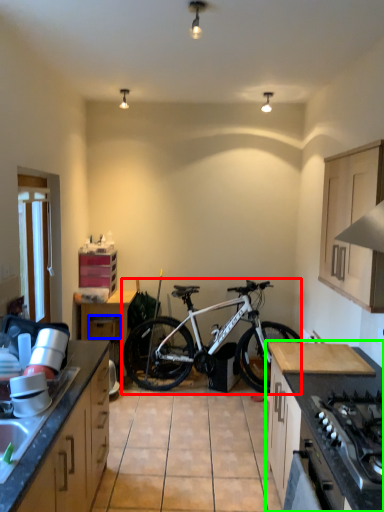
Question: Which object is positioned farthest from bicycle (highlighted by a red box)? Select from drawer (highlighted by a blue box) and cabinetry (highlighted by a green box).

Choices:
 (A) drawer
 (B) cabinetry

Answer: (B)